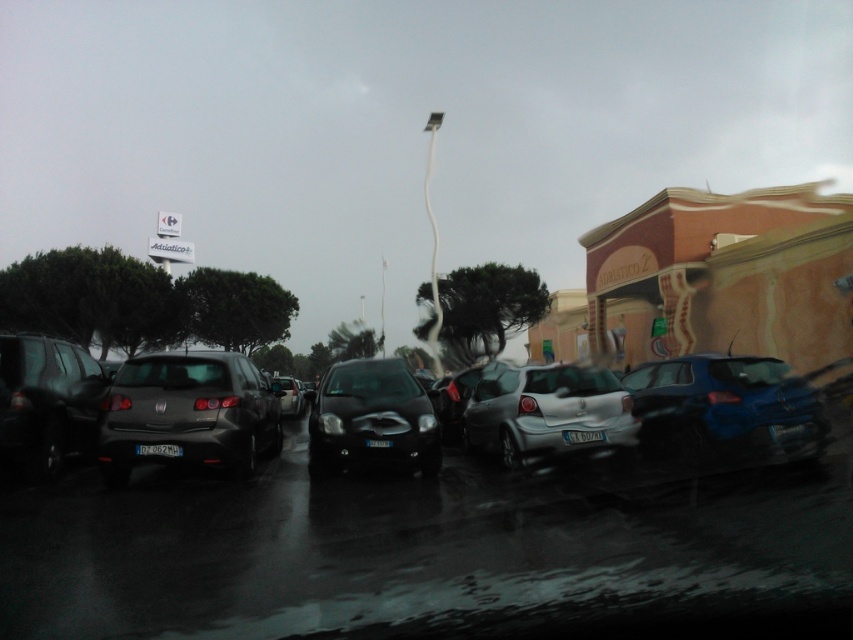
Based on the photo, you are a delivery driver who needs to park your truck in this parking lot. You see a glossy metallic car at center and a matte black hatchback at center. Which vehicle should you avoid parking too close to if you want to prevent water from splashing onto your truck during rain?

You should avoid parking too close to the glossy metallic car at center because it is larger in size than the matte black hatchback at center, meaning it may create a larger splash zone when water accumulates.